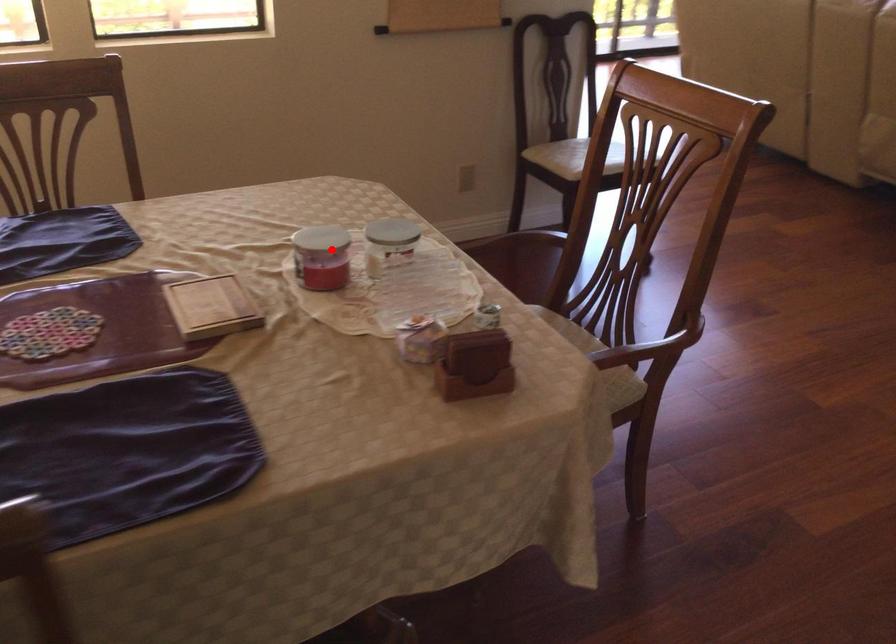
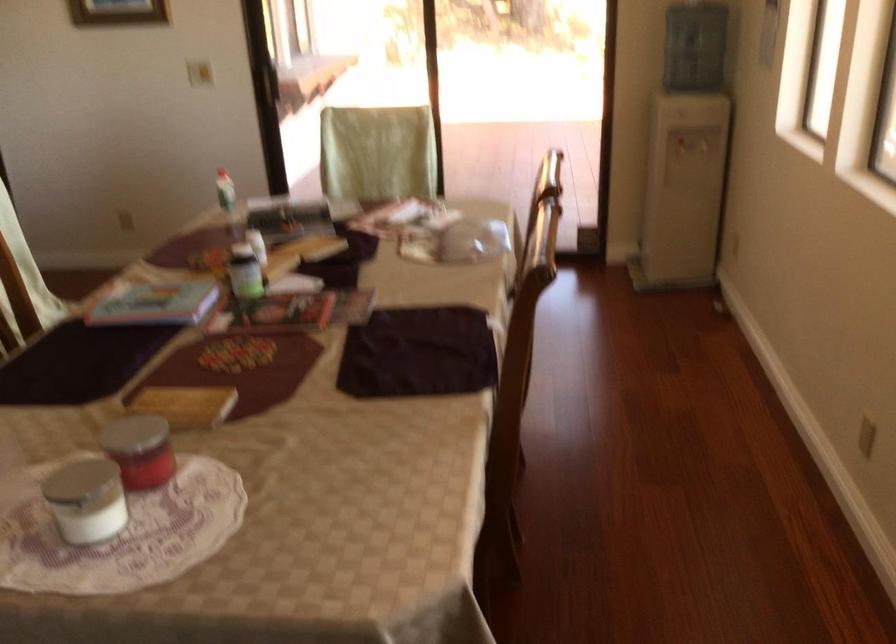
Question: I am providing you with two images of the same scene from different viewpoints. In image1, a red point is highlighted. Considering the same 3D point in image2, which of the following is correct?

Choices:
 (A) It is closer
 (B) It is farther

Answer: (A)